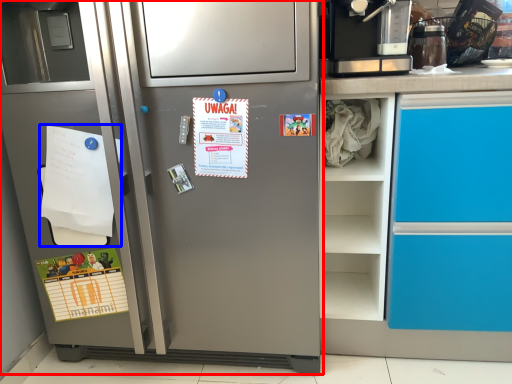
Question: Among these objects, which one is nearest to the camera, refrigerator (highlighted by a red box) or flyer (highlighted by a blue box)?

Choices:
 (A) refrigerator
 (B) flyer

Answer: (A)